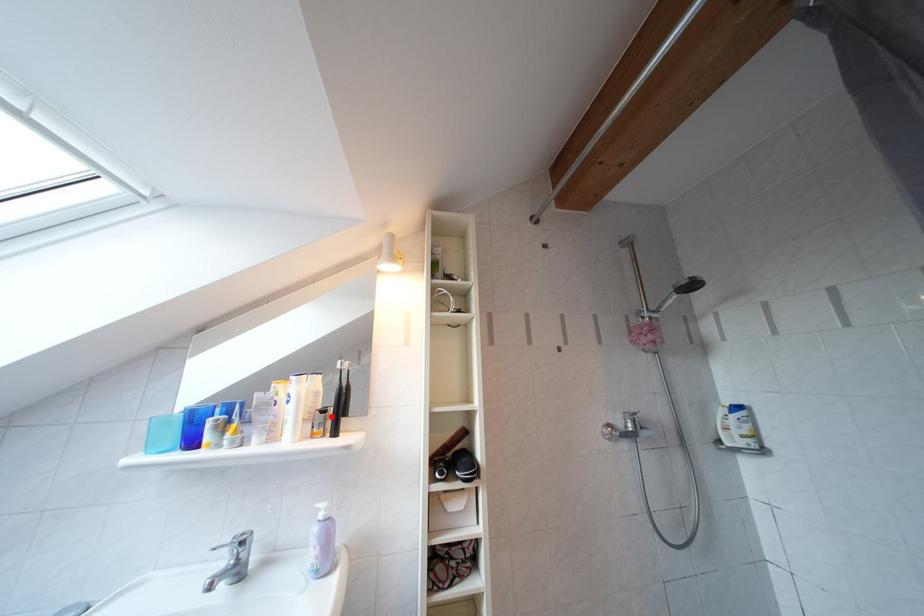
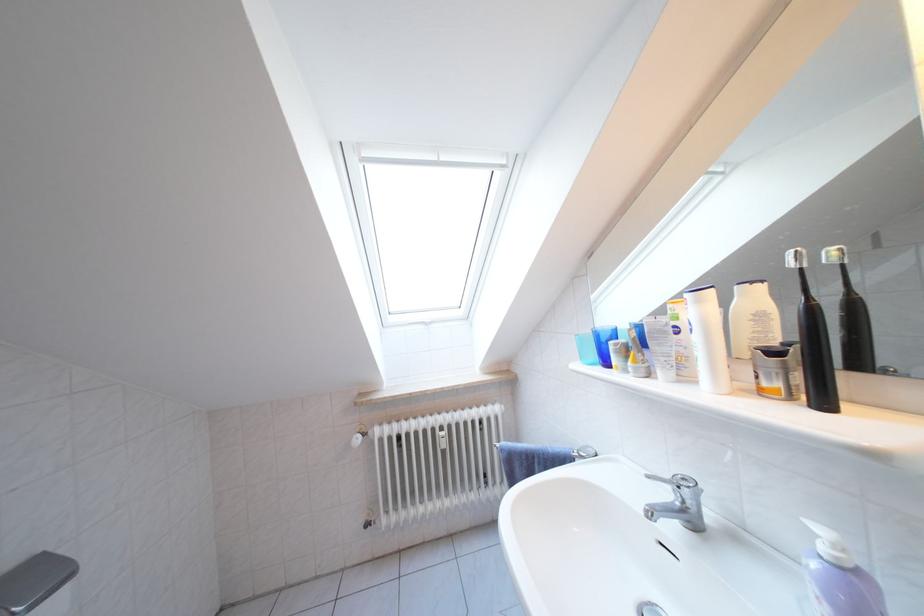
Question: I am providing you with two images of the same scene from different viewpoints. A red point is marked on the first image. At the location where the point appears in image 1, is it still visible in image 2?

Choices:
 (A) Yes
 (B) No

Answer: (A)